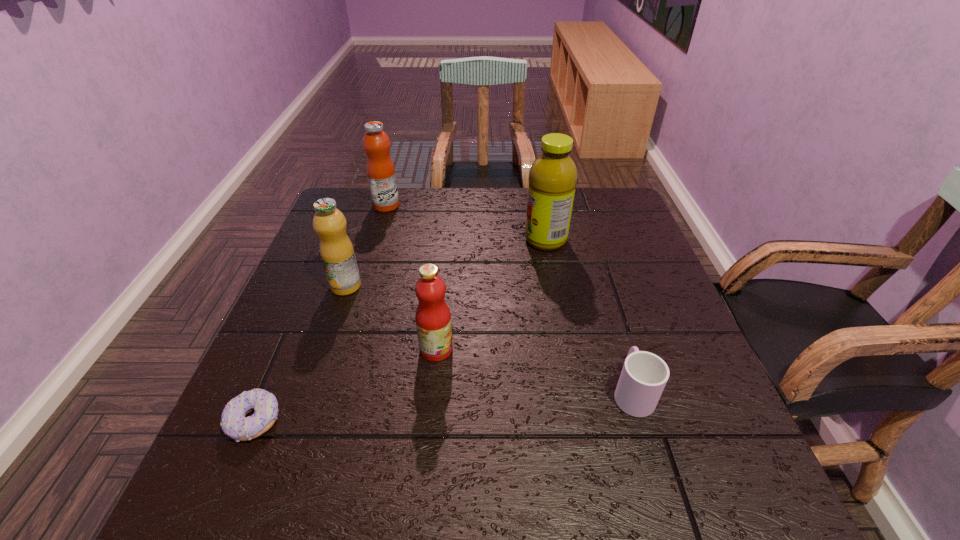
The height and width of the screenshot is (540, 960). What are the coordinates of `empty space between the third nearest fruit juice and the doughnut` in the screenshot? It's located at (400, 330).

Where is `free spot between the fourth object from left to right and the fifth tallest object`? This screenshot has height=540, width=960. free spot between the fourth object from left to right and the fifth tallest object is located at coordinates (534, 370).

Image resolution: width=960 pixels, height=540 pixels. Identify the location of empty space that is in between the rightmost object and the third farthest fruit juice. (489, 339).

Find the location of a particular element. This screenshot has width=960, height=540. free space that is in between the third fruit juice from left to right and the rightmost fruit juice is located at coordinates (491, 295).

Where is `free space between the cup and the fourth nearest object`? The width and height of the screenshot is (960, 540). free space between the cup and the fourth nearest object is located at coordinates (489, 339).

Find the location of a particular element. free spot between the third nearest object and the farthest fruit juice is located at coordinates (411, 278).

What are the coordinates of `free spot between the doughnut and the third nearest fruit juice` in the screenshot? It's located at (400, 330).

Image resolution: width=960 pixels, height=540 pixels. I want to click on the second closest object to the rightmost object, so click(x=553, y=175).

In order to click on object that stands as the closest to the rightmost fruit juice in this screenshot , I will do `click(433, 318)`.

Locate an element on the screen. The height and width of the screenshot is (540, 960). fruit juice that is the second closest one to the fourth object from left to right is located at coordinates (553, 175).